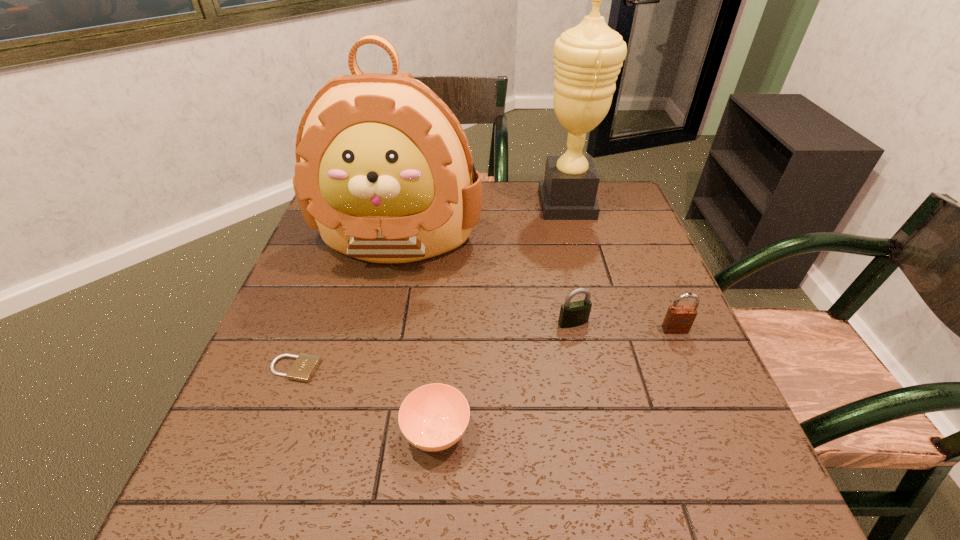
Locate an element on the screen. padlock that is at the left edge is located at coordinates (304, 367).

Image resolution: width=960 pixels, height=540 pixels. Find the location of `trophy cup positioned at the right edge`. trophy cup positioned at the right edge is located at coordinates (588, 57).

Identify the location of padlock at the right edge. The image size is (960, 540). (679, 319).

The image size is (960, 540). I want to click on object positioned at the far left corner, so click(x=384, y=170).

In order to click on object located at the far right corner in this screenshot , I will do `click(588, 57)`.

In the image, there is a desktop. At what (x,y) coordinates should I click in order to perform the action: click on free space at the near edge. Please return your answer as a coordinate pair (x, y). Image resolution: width=960 pixels, height=540 pixels. Looking at the image, I should click on (648, 482).

Find the location of a particular element. free space at the left edge is located at coordinates (313, 273).

Where is `vacant space at the right edge of the desktop`? vacant space at the right edge of the desktop is located at coordinates (621, 275).

I want to click on vacant area at the far right corner, so click(624, 205).

This screenshot has height=540, width=960. What are the coordinates of `free space at the near right corner of the desktop` in the screenshot? It's located at pos(684,512).